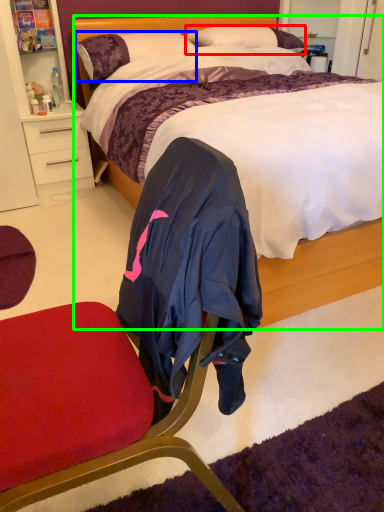
Question: Based on their relative distances, which object is farther from pillow (highlighted by a red box)? Choose from pillow (highlighted by a blue box) and bed (highlighted by a green box).

Choices:
 (A) pillow
 (B) bed

Answer: (B)